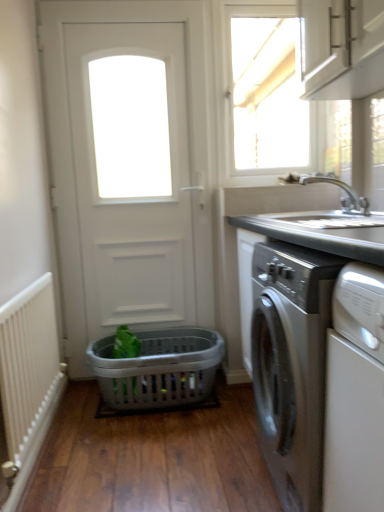
Image resolution: width=384 pixels, height=512 pixels. In order to click on free space above white matte door at center (from a real-world perspective) in this screenshot , I will do coord(115,1).